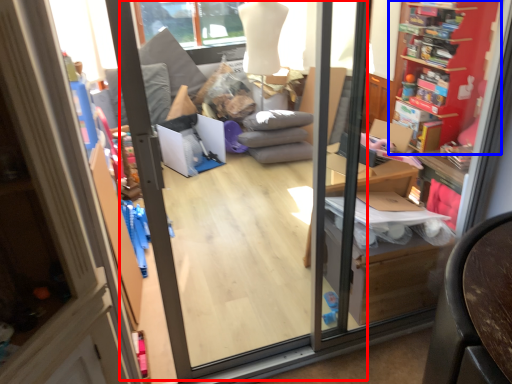
Question: Which object is closer to the camera taking this photo, screen door (highlighted by a red box) or shelf (highlighted by a blue box)?

Choices:
 (A) screen door
 (B) shelf

Answer: (A)